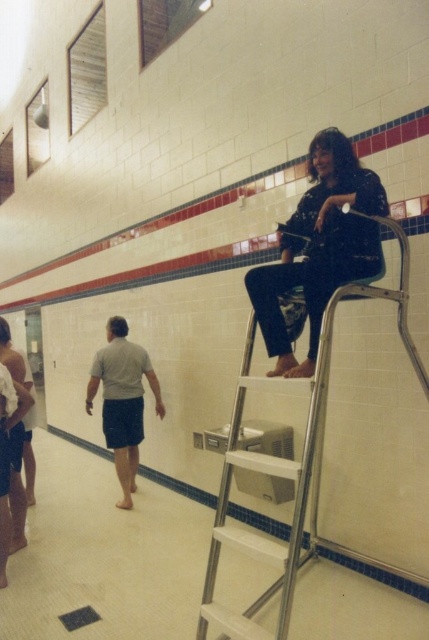
Who is shorter, silver metallic ladder at upper center or gray cotton shorts at lower left?

Standing shorter between the two is gray cotton shorts at lower left.

Measure the distance between silver metallic ladder at upper center and camera.

silver metallic ladder at upper center and camera are 2.13 meters apart from each other.

Image resolution: width=429 pixels, height=640 pixels. Identify the location of silver metallic ladder at upper center. (296, 467).

Does silver metallic ladder at upper center have a greater width compared to matte black shirt at upper right?

Yes.

Is silver metallic ladder at upper center positioned in front of matte black shirt at upper right?

Yes, it is.

This screenshot has width=429, height=640. What do you see at coordinates (296, 467) in the screenshot?
I see `silver metallic ladder at upper center` at bounding box center [296, 467].

Locate an element on the screen. Image resolution: width=429 pixels, height=640 pixels. silver metallic ladder at upper center is located at coordinates (296, 467).

Is matte black shirt at upper right to the left of gray cotton shorts at lower left from the viewer's perspective?

In fact, matte black shirt at upper right is to the right of gray cotton shorts at lower left.

Does matte black shirt at upper right have a smaller size compared to gray cotton shorts at lower left?

Yes, matte black shirt at upper right is smaller than gray cotton shorts at lower left.

Is point (311, 230) in front of point (120, 448)?

Yes, it is in front of point (120, 448).

What are the coordinates of `matte black shirt at upper right` in the screenshot? It's located at pos(320,248).